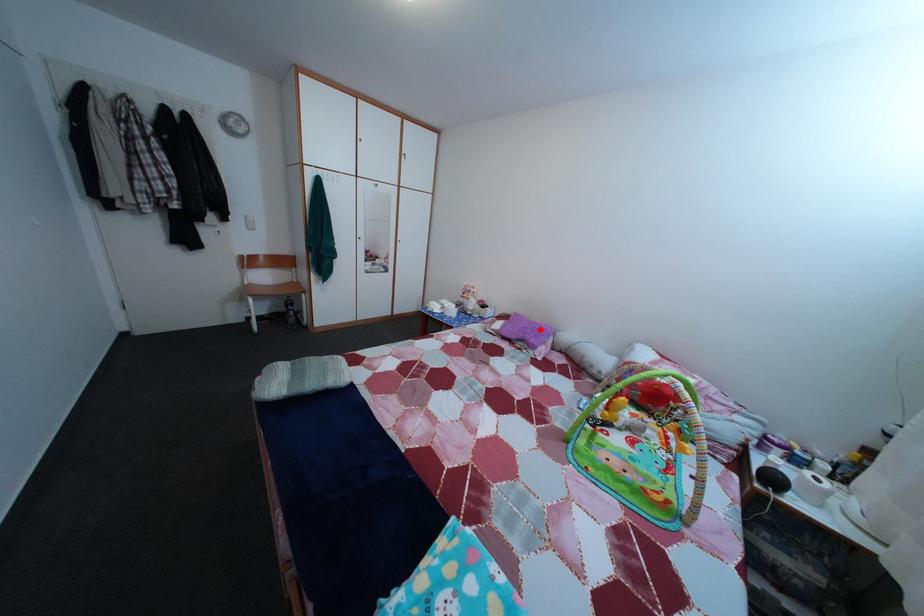
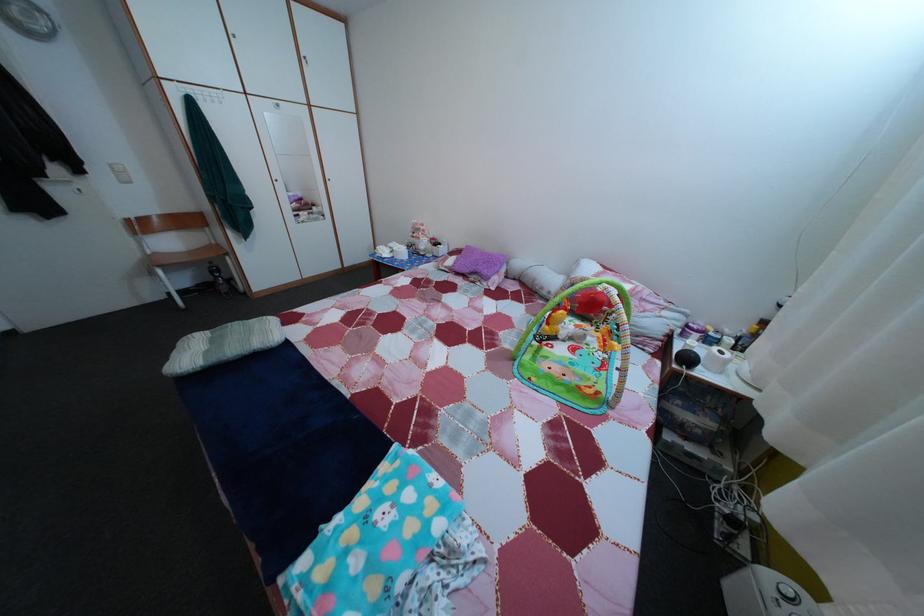
Question: I am providing you with two images of the same scene from different viewpoints. A red point is shown in image1. For the corresponding object point in image2, is it positioned nearer or farther from the camera?

Choices:
 (A) Nearer
 (B) Farther

Answer: (A)